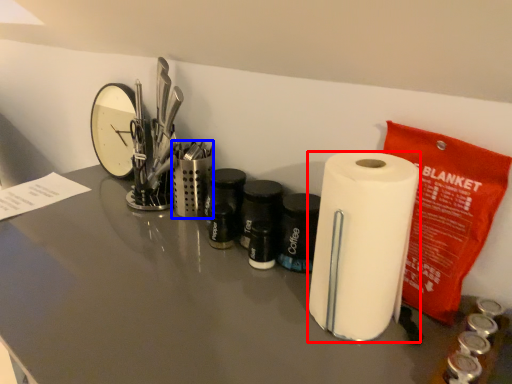
Question: Among these objects, which one is nearest to the camera, paper towel (highlighted by a red box) or stationery (highlighted by a blue box)?

Choices:
 (A) paper towel
 (B) stationery

Answer: (A)